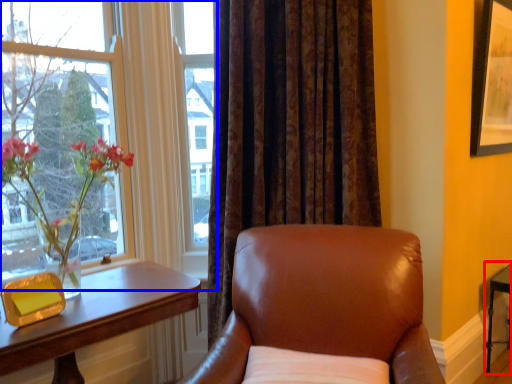
Question: Which of the following is the closest to the observer, side table (highlighted by a red box) or window (highlighted by a blue box)?

Choices:
 (A) side table
 (B) window

Answer: (B)